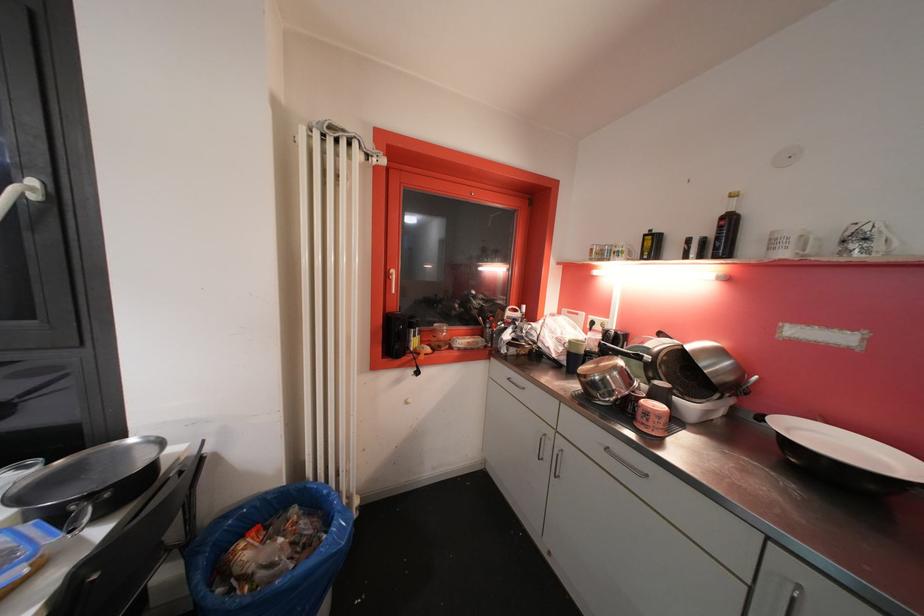
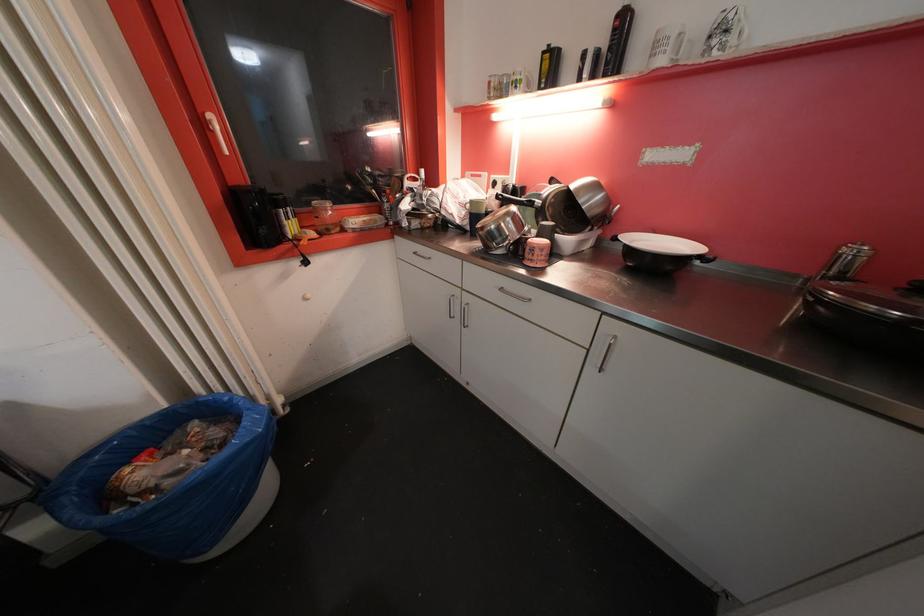
Locate, in the second image, the point that corresponds to pixel 444 349 in the first image.

(333, 233)